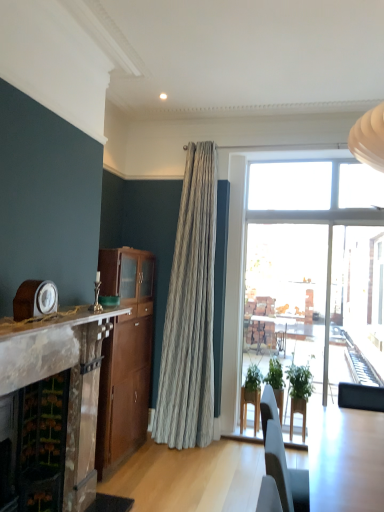
Question: In terms of width, does green matte plant at center, which is the second houseplant in right-to-left order, look wider or thinner when compared to marble fireplace at left?

Choices:
 (A) thin
 (B) wide

Answer: (A)

Question: Which is correct: green matte plant at center, which is the second houseplant in right-to-left order, is inside marble fireplace at left, or outside of it?

Choices:
 (A) inside
 (B) outside

Answer: (B)

Question: Which object is positioned closest to the green leafy plant at center, which is the 1th houseplant from right to left?

Choices:
 (A) light wood table at lower right
 (B) green matte plant at center, which ranks as the first houseplant in left-to-right order
 (C) wooden clock at left
 (D) wooden cabinet at center
 (E) marble mantel at left

Answer: (B)

Question: Based on their relative distances, which object is farther from the marble fireplace at left?

Choices:
 (A) light wood table at lower right
 (B) marble mantel at left
 (C) green matte plant at center, which is the second houseplant in right-to-left order
 (D) wooden cabinet at center
 (E) green leafy plant at center, which is the 1th houseplant from right to left

Answer: (E)